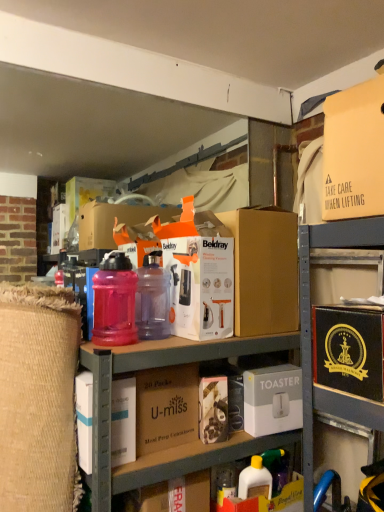
Question: Considering their positions, is brown cardboard box at center, which is the fourth box from top to bottom, located in front of or behind white cardboard box at lower left, placed as the second box when sorted from bottom to top?

Choices:
 (A) behind
 (B) front

Answer: (A)

Question: Considering the positions of brown cardboard box at center, which is the third box in bottom-to-top order, and white cardboard box at lower left, placed as the second box when sorted from bottom to top, in the image, is brown cardboard box at center, which is the third box in bottom-to-top order, wider or thinner than white cardboard box at lower left, placed as the second box when sorted from bottom to top,?

Choices:
 (A) thin
 (B) wide

Answer: (B)

Question: Considering the real-world distances, which object is closest to the white cardboard toaster at center, the 6th box from the top?

Choices:
 (A) translucent pink plastic water bottle at center-left, placed as the second bottle when sorted from right to left
 (B) black cardboard box at right, the 3th box viewed from the top
 (C) brown cardboard box at center, which is the fourth box from top to bottom
 (D) matte cardboard box at upper right, which is counted as the first box, starting from the top
 (E) yellow plastic bottle at lower center

Answer: (E)

Question: Which of these objects is positioned closest to the yellow plastic bottle at lower center?

Choices:
 (A) white cardboard box at lower center
 (B) purple translucent bottle at center, which is the second bottle in left-to-right order
 (C) white cardboard toaster at center, the 6th box from the top
 (D) translucent pink plastic water bottle at center-left, placed as the second bottle when sorted from right to left
 (E) matte cardboard box at upper right, which is counted as the first box, starting from the top

Answer: (A)